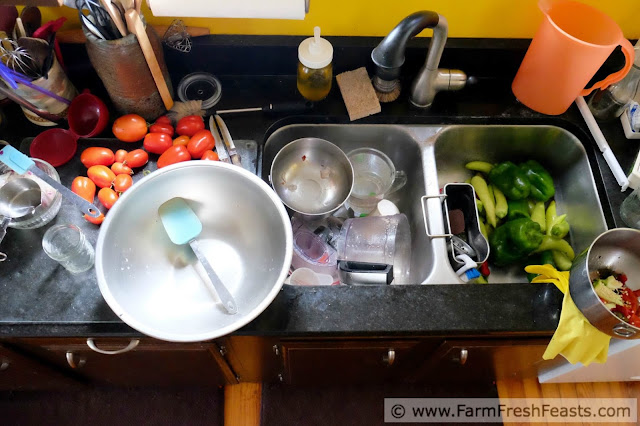
This screenshot has width=640, height=426. What are the coordinates of `food processor bowl` in the screenshot? It's located at (358, 246).